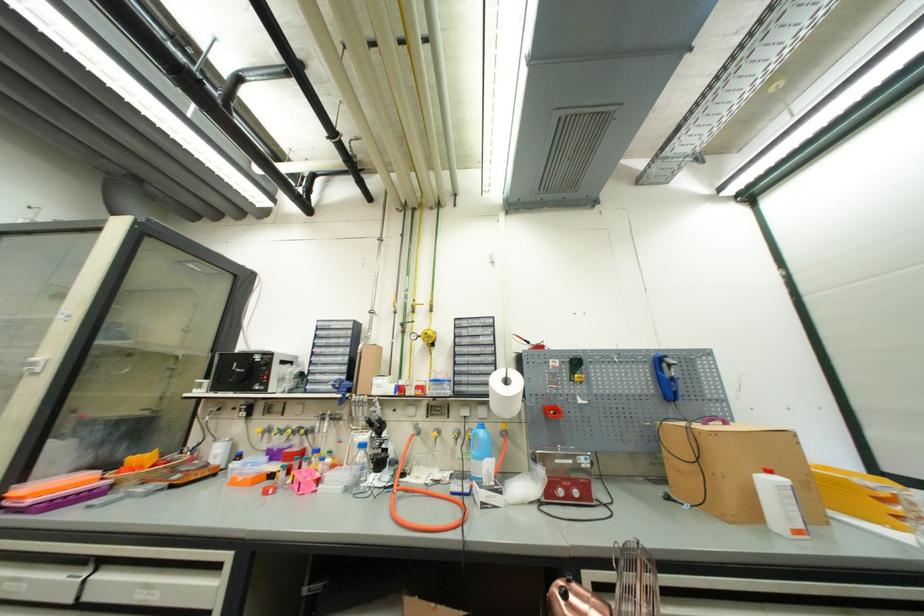
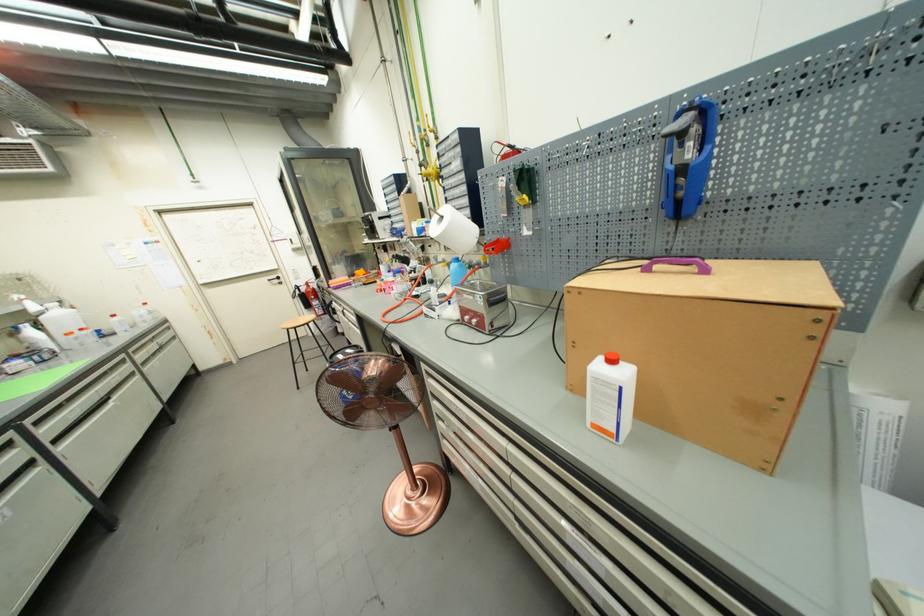
Where in the second image is the point corresponding to point (775, 474) from the first image?

(617, 363)